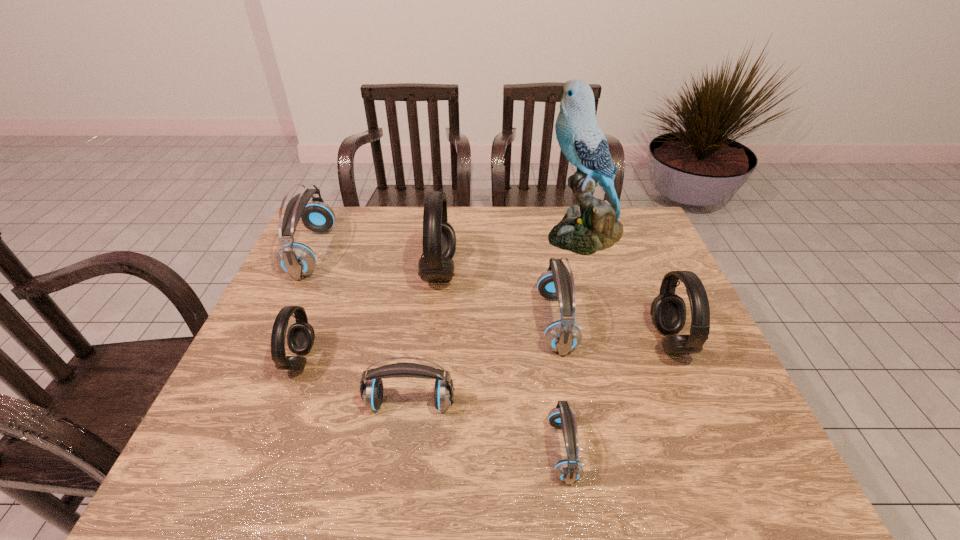
This screenshot has height=540, width=960. What are the coordinates of `vacant space at the near left corner of the desktop` in the screenshot? It's located at (255, 467).

At what (x,y) coordinates should I click in order to perform the action: click on vacant space at the far right corner. Please return your answer as a coordinate pair (x, y). Image resolution: width=960 pixels, height=540 pixels. Looking at the image, I should click on (655, 237).

Locate an element on the screen. This screenshot has width=960, height=540. unoccupied position between the parakeet and the second blue headset from left to right is located at coordinates (496, 319).

Where is `vacant area that lies between the second farthest blue headset and the second gray headset from left to right`? The height and width of the screenshot is (540, 960). vacant area that lies between the second farthest blue headset and the second gray headset from left to right is located at coordinates (497, 296).

Find the location of a particular element. The image size is (960, 540). vacant space that's between the second biggest blue headset and the rightmost headset is located at coordinates (612, 332).

Image resolution: width=960 pixels, height=540 pixels. What are the coordinates of `vacant point located between the farthest gray headset and the second biggest gray headset` in the screenshot? It's located at (554, 306).

This screenshot has width=960, height=540. Identify the location of vacant area between the biggest gray headset and the parakeet. (512, 253).

Locate an element on the screen. Image resolution: width=960 pixels, height=540 pixels. free space that is in between the leftmost headset and the leftmost gray headset is located at coordinates (306, 306).

Identify the location of free area in between the leftmost gray headset and the second smallest blue headset. The width and height of the screenshot is (960, 540). (355, 381).

Where is `free space between the farthest blue headset and the smallest gray headset`? This screenshot has width=960, height=540. free space between the farthest blue headset and the smallest gray headset is located at coordinates (306, 306).